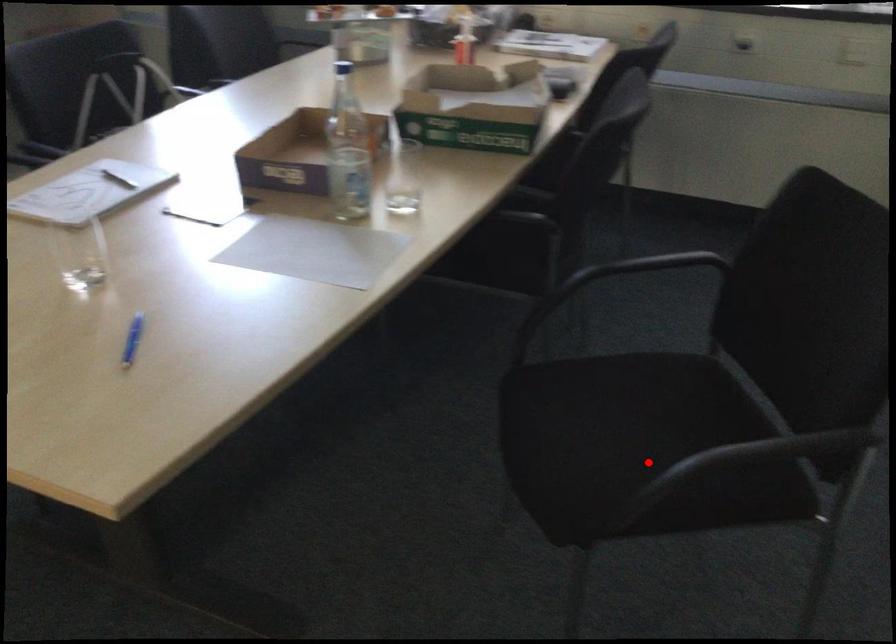
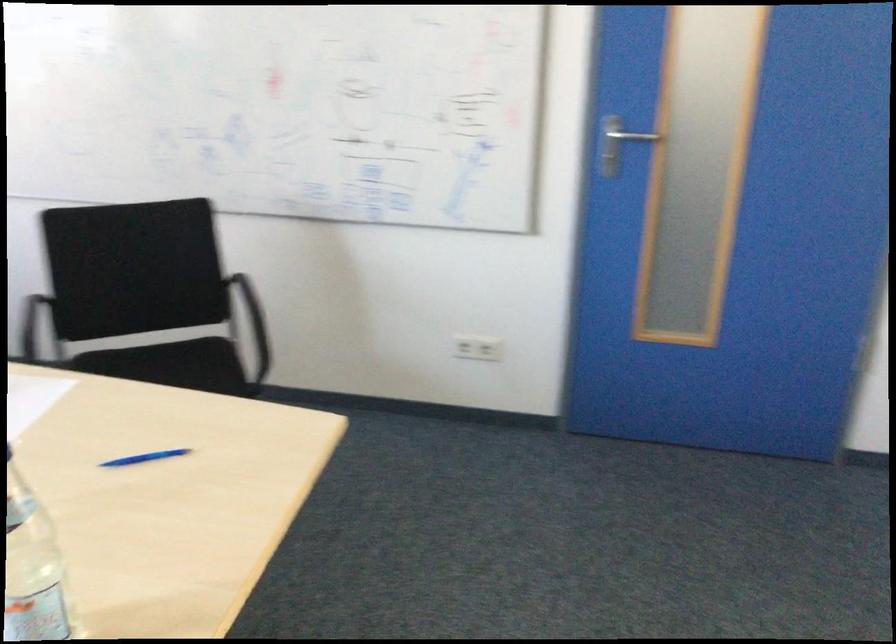
Question: I am providing you with two images of the same scene from different viewpoints. Given a red point in image1, look at the same physical point in image2. Is it:

Choices:
 (A) Closer to the viewpoint
 (B) Farther from the viewpoint

Answer: (B)